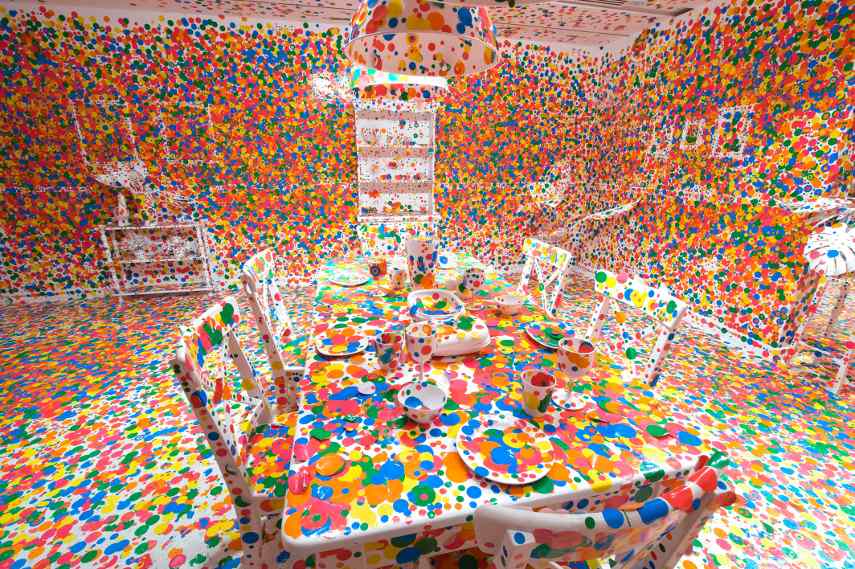
Locate an element on the screen. The height and width of the screenshot is (569, 855). ceiling is located at coordinates (587, 17).